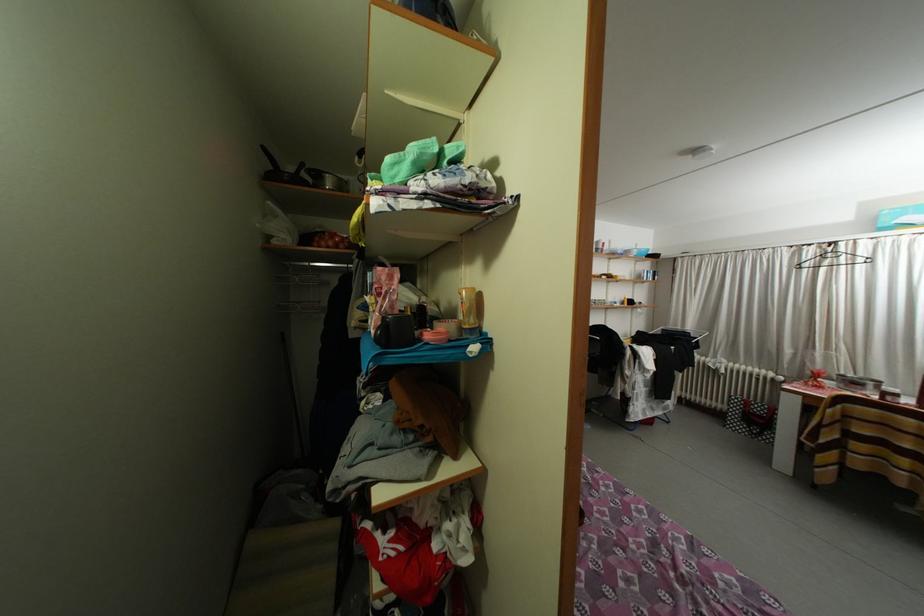
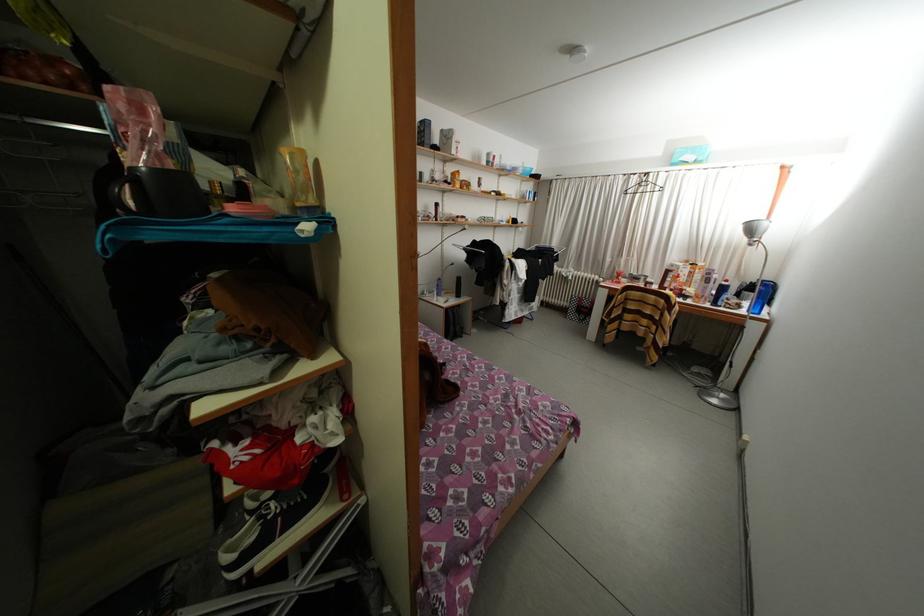
Find the pixel in the second image that matches [432,307] in the first image.

(250, 183)